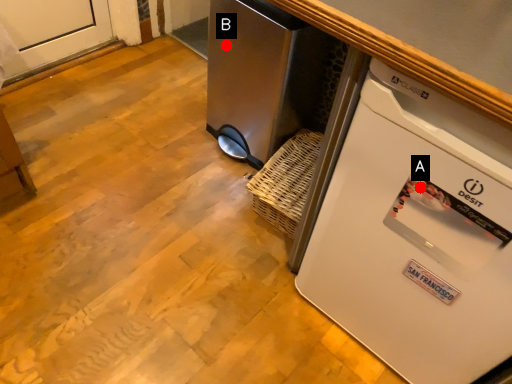
Question: Two points are circled on the image, labeled by A and B beside each circle. Which of the following is the farthest from the observer?

Choices:
 (A) A is further
 (B) B is further

Answer: (B)